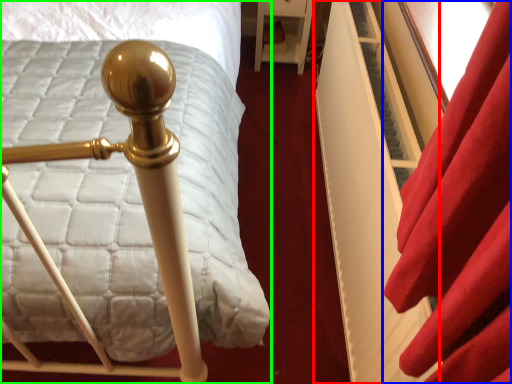
Question: Which is farther away from bed frame (highlighted by a red box)? curtain (highlighted by a blue box) or bed (highlighted by a green box)?

Choices:
 (A) curtain
 (B) bed

Answer: (B)